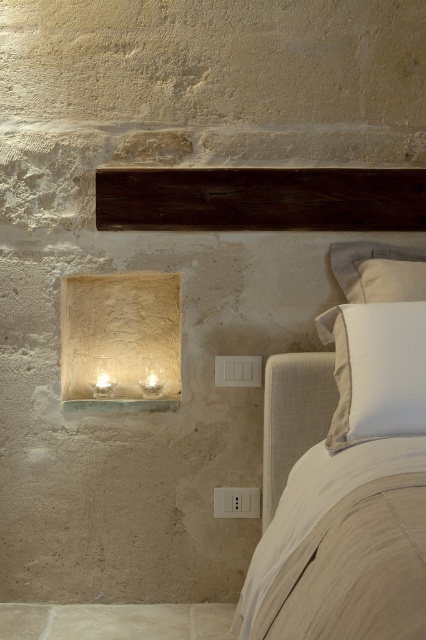
You are arranging a photo shoot in the bedroom scene. You need to place a decorative vase between the beige linen bed at right and the white linen pillow at upper right. Based on their positions, where should you place the vase?

The beige linen bed at right is positioned on the left side of white linen pillow at upper right, so the vase should be placed between them, closer to the beige linen bed at right since it is to the left of the white linen pillow at upper right.

You are a painter standing in the room and want to hang a 24 inch painting between the dark wood beam at upper center and the white linen pillow at upper right. Can the painting fit in the space between them?

The distance between the dark wood beam at upper center and the white linen pillow at upper right is 24.12 inches, so a 24 inch painting can fit with a small amount of space remaining.